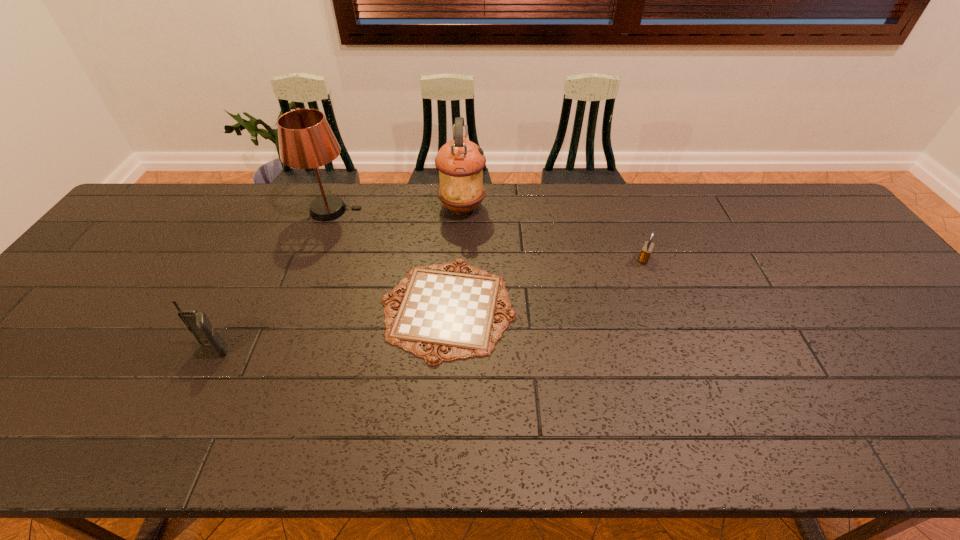
At what (x,y) coordinates should I click in order to perform the action: click on free space between the shortest object and the second object from left to right. Please return your answer as a coordinate pair (x, y). This screenshot has height=540, width=960. Looking at the image, I should click on (390, 259).

I want to click on empty location between the second object from left to right and the oil lamp, so click(396, 209).

Where is `vacant region between the padlock and the oil lamp`? vacant region between the padlock and the oil lamp is located at coordinates (553, 233).

Locate an element on the screen. Image resolution: width=960 pixels, height=540 pixels. vacant area between the padlock and the chessboard is located at coordinates (546, 284).

Where is `vacant space that's between the oil lamp and the chessboard`? The width and height of the screenshot is (960, 540). vacant space that's between the oil lamp and the chessboard is located at coordinates (455, 258).

Where is `empty space between the chessboard and the third tallest object`? Image resolution: width=960 pixels, height=540 pixels. empty space between the chessboard and the third tallest object is located at coordinates (331, 329).

You are a GUI agent. You are given a task and a screenshot of the screen. Output one action in this format:
    pyautogui.click(x=<x>, y=<y>)
    Task: Click on the unoccupied area between the chessboard and the cellular telephone
    
    Given the screenshot: What is the action you would take?
    (x=331, y=329)

This screenshot has height=540, width=960. In order to click on empty location between the rightmost object and the second object from left to right in this screenshot , I will do `click(488, 234)`.

Image resolution: width=960 pixels, height=540 pixels. Identify the location of vacant region between the oil lamp and the lampshade. (396, 209).

This screenshot has width=960, height=540. What are the coordinates of `object that stands as the fourth closest to the chessboard` in the screenshot? It's located at (646, 251).